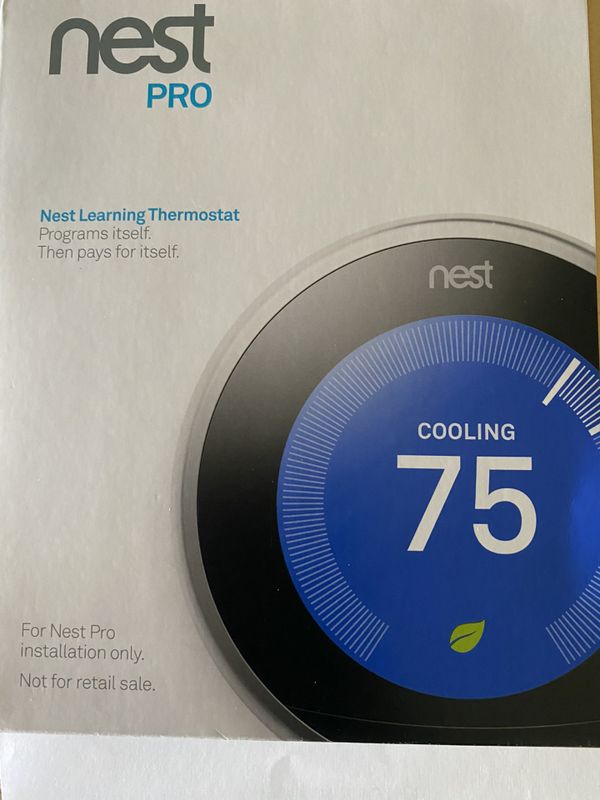
Where is `sliver of table showing in background`? sliver of table showing in background is located at coordinates (596, 25).